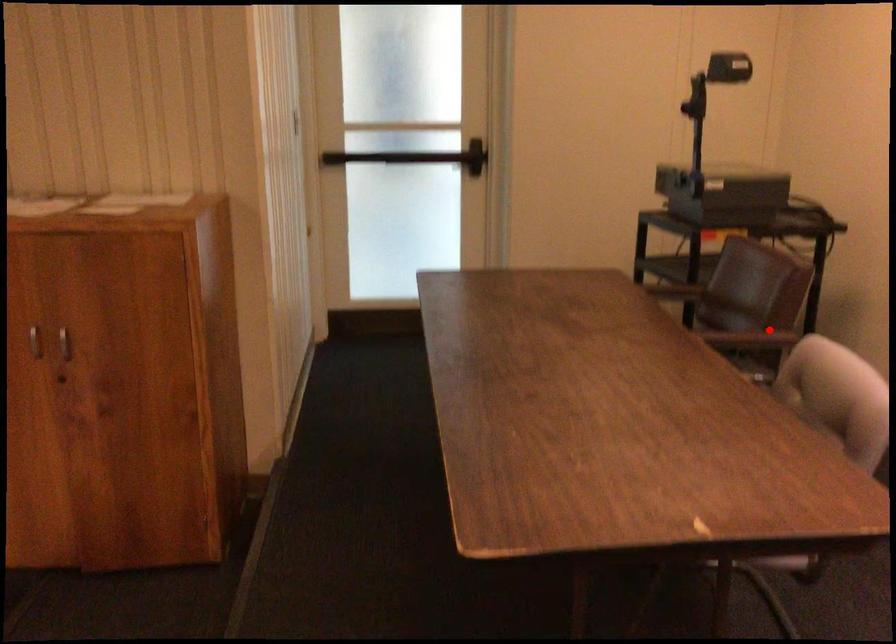
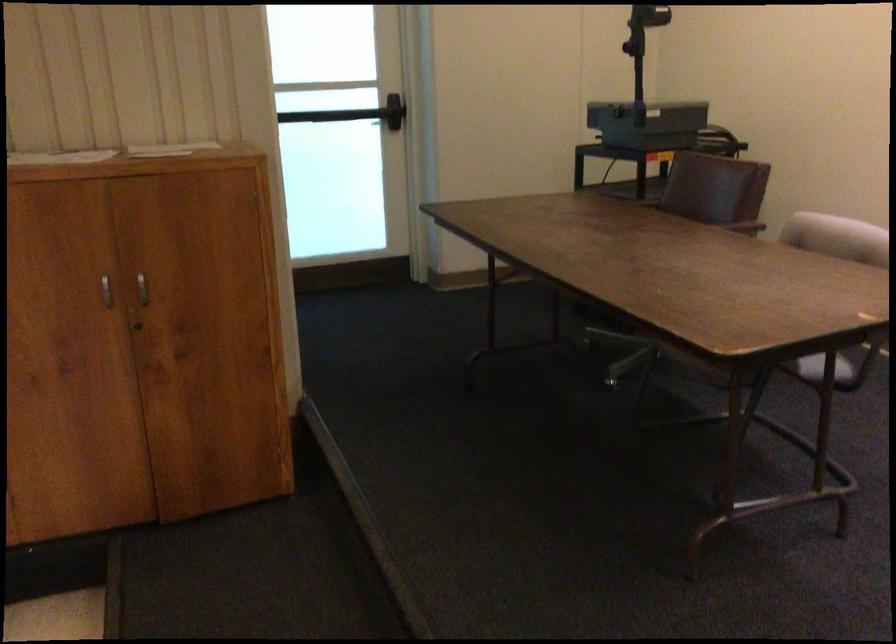
Question: I am providing you with two images of the same scene from different viewpoints. A red point is marked on the first image. Is the red point's position out of view in image 2?

Choices:
 (A) Yes
 (B) No

Answer: (B)